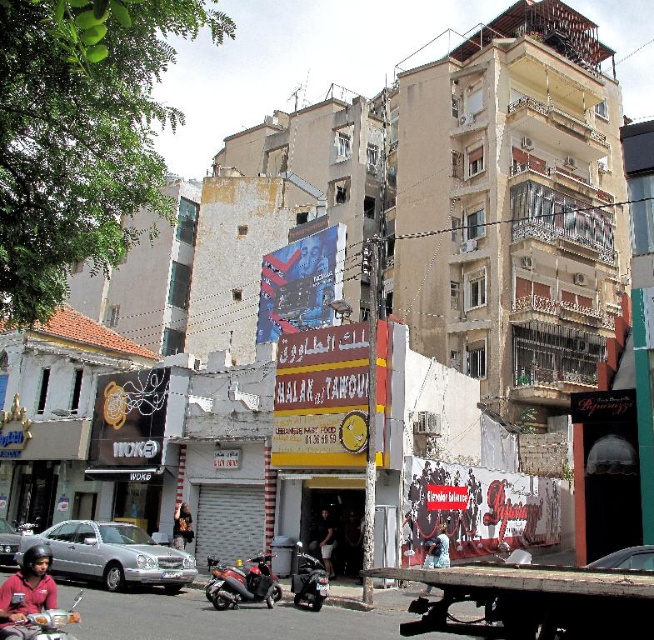
Question: Estimate the real-world distances between objects in this image. Which object is closer to the light brown leather jacket at center?

Choices:
 (A) matte black helmet at lower left
 (B) shiny metallic scooter at lower center

Answer: (B)

Question: Which point is farther to the camera?

Choices:
 (A) matte black helmet at lower left
 (B) silver metallic car at lower left
 (C) silver metallic sedan at lower left

Answer: (C)

Question: Considering the relative positions of shiny metallic scooter at lower center and light brown leather jacket at center in the image provided, where is shiny metallic scooter at lower center located with respect to light brown leather jacket at center?

Choices:
 (A) below
 (B) above

Answer: (A)

Question: Can you confirm if silver metallic car at lower left is wider than matte black helmet at lower left?

Choices:
 (A) no
 (B) yes

Answer: (B)

Question: Can you confirm if silver metallic car at lower left is positioned to the right of matte black helmet at lower left?

Choices:
 (A) no
 (B) yes

Answer: (A)

Question: Estimate the real-world distances between objects in this image. Which object is closer to the light brown leather jacket at center?

Choices:
 (A) dark blue jeans at center
 (B) silver metallic car at lower left

Answer: (B)